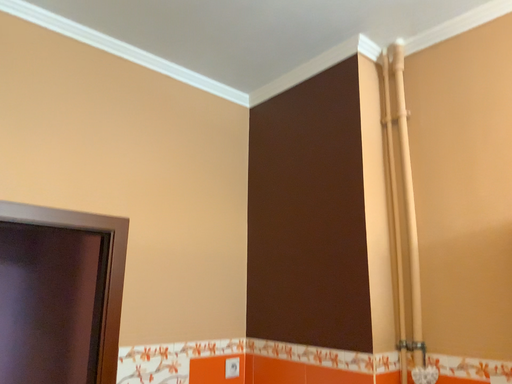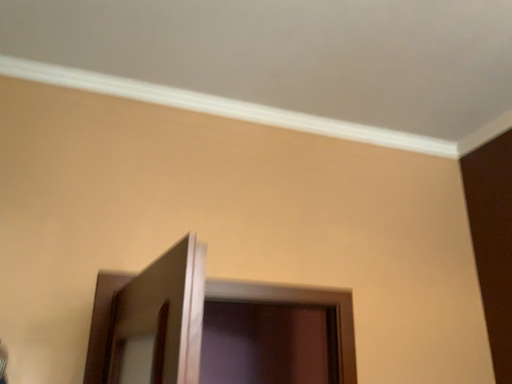
Question: Which way did the camera rotate in the video?

Choices:
 (A) rotated right
 (B) rotated left

Answer: (B)